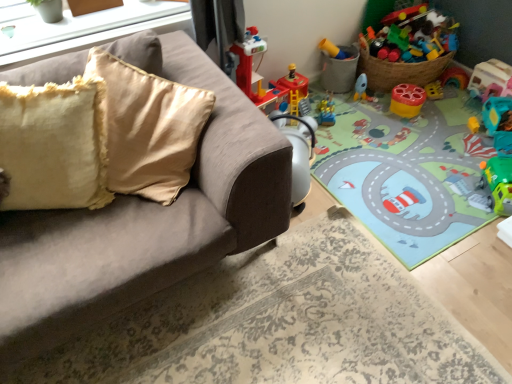
You are a GUI agent. You are given a task and a screenshot of the screen. Output one action in this format:
    pyautogui.click(x=<x>, y=<y>)
    Task: Click on the free region on the left part of translucent plastic toy car at upper right, which is the sixth toy in left-to-right order
    This screenshot has width=512, height=384.
    Given the screenshot: What is the action you would take?
    pyautogui.click(x=456, y=100)